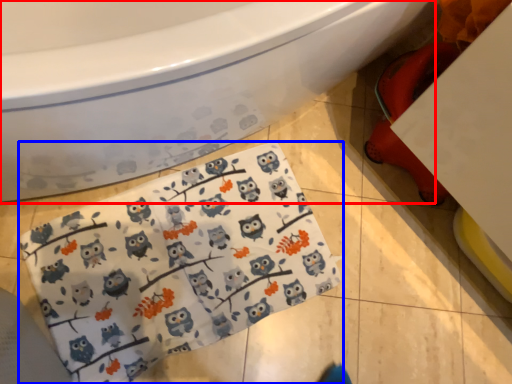
Question: Which object is further to the camera taking this photo, bathtub (highlighted by a red box) or baby clothe (highlighted by a blue box)?

Choices:
 (A) bathtub
 (B) baby clothe

Answer: (B)